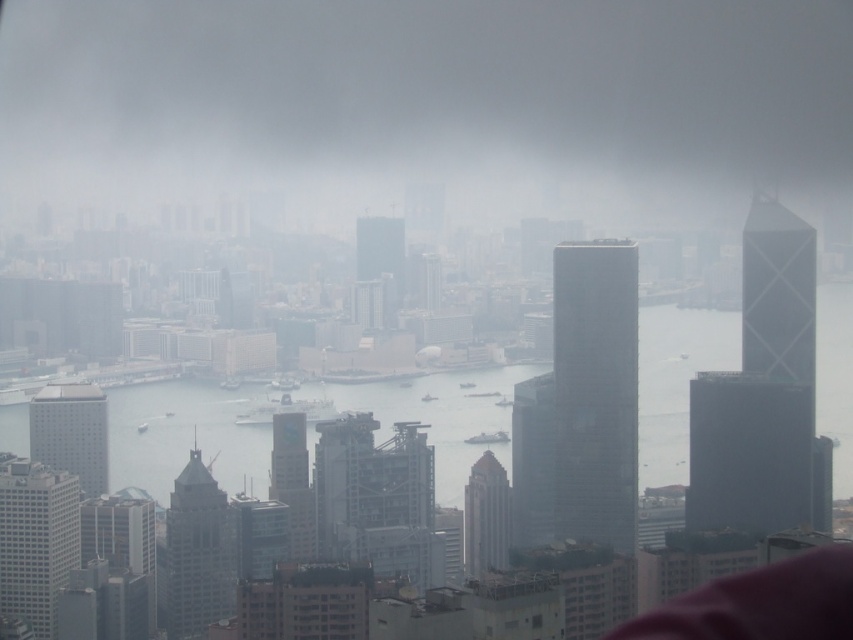
Is point (740, 394) farther from camera compared to point (480, 538)?

Yes, it is.

Does smooth glass skyscraper at right have a lesser height compared to gray glass skyscraper at center?

No, smooth glass skyscraper at right is not shorter than gray glass skyscraper at center.

Who is more forward, (x=747, y=486) or (x=480, y=506)?

Positioned in front is point (x=480, y=506).

Where is `smooth glass skyscraper at right`? Image resolution: width=853 pixels, height=640 pixels. smooth glass skyscraper at right is located at coordinates (747, 452).

Between point (624, 381) and point (105, 396), which one is positioned behind?

Positioned behind is point (105, 396).

Can you confirm if glassy reflective skyscraper at center is smaller than white matte building at lower left?

Actually, glassy reflective skyscraper at center might be larger than white matte building at lower left.

Which is behind, point (618, 378) or point (102, 432)?

The point (102, 432) is behind.

The width and height of the screenshot is (853, 640). I want to click on glassy reflective skyscraper at center, so click(x=595, y=390).

Looking at this image, can you confirm if clear water at center is wider than smooth glass skyscraper at right?

Yes, clear water at center is wider than smooth glass skyscraper at right.

Which is more to the left, clear water at center or smooth glass skyscraper at right?

From the viewer's perspective, clear water at center appears more on the left side.

Locate an element on the screen. This screenshot has width=853, height=640. clear water at center is located at coordinates (183, 435).